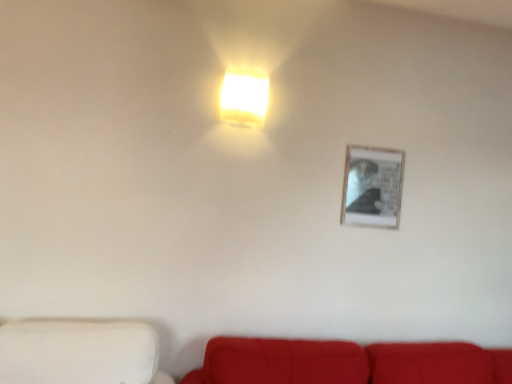
Question: Is velvet red couch at lower center looking in the opposite direction of matte white square at upper center?

Choices:
 (A) no
 (B) yes

Answer: (A)

Question: Does velvet red couch at lower center have a larger size compared to matte white square at upper center?

Choices:
 (A) yes
 (B) no

Answer: (A)

Question: From the image's perspective, would you say velvet red couch at lower center is shown under matte white square at upper center?

Choices:
 (A) yes
 (B) no

Answer: (A)

Question: Can you confirm if velvet red couch at lower center is positioned to the left of matte white square at upper center?

Choices:
 (A) yes
 (B) no

Answer: (B)

Question: From the image's perspective, does velvet red couch at lower center appear higher than matte white square at upper center?

Choices:
 (A) no
 (B) yes

Answer: (A)

Question: Considering their positions, is matte white square at upper center located in front of or behind velvet red couch at lower center?

Choices:
 (A) behind
 (B) front

Answer: (A)

Question: From the image's perspective, is matte white square at upper center positioned above or below velvet red couch at lower center?

Choices:
 (A) below
 (B) above

Answer: (B)

Question: In the image, is matte white square at upper center on the left side or the right side of velvet red couch at lower center?

Choices:
 (A) left
 (B) right

Answer: (A)

Question: Do you think matte white square at upper center is within velvet red couch at lower center, or outside of it?

Choices:
 (A) outside
 (B) inside

Answer: (A)

Question: From their relative heights in the image, would you say matte white square at upper center is taller or shorter than white matte wall at lower left?

Choices:
 (A) tall
 (B) short

Answer: (A)

Question: Considering the positions of point (256, 119) and point (148, 352), is point (256, 119) closer or farther from the camera than point (148, 352)?

Choices:
 (A) farther
 (B) closer

Answer: (A)

Question: From a real-world perspective, is matte white square at upper center above or below white matte wall at lower left?

Choices:
 (A) above
 (B) below

Answer: (A)

Question: Visually, is matte white square at upper center positioned to the left or to the right of white matte wall at lower left?

Choices:
 (A) right
 (B) left

Answer: (A)

Question: Relative to velvet red couch at lower center, is white matte wall at lower left in front or behind?

Choices:
 (A) front
 (B) behind

Answer: (A)

Question: Choose the correct answer: Is white matte wall at lower left inside velvet red couch at lower center or outside it?

Choices:
 (A) outside
 (B) inside

Answer: (A)